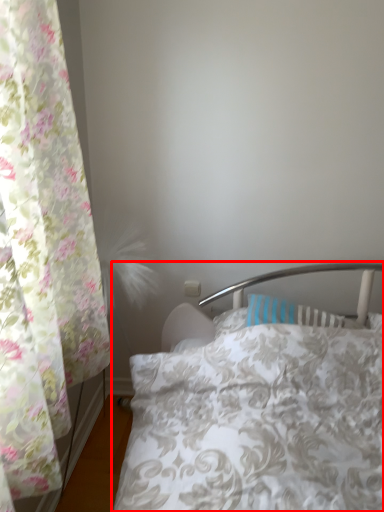
Question: From the image's perspective, where is bed (annotated by the red box) located in relation to curtain in the image?

Choices:
 (A) above
 (B) below

Answer: (B)